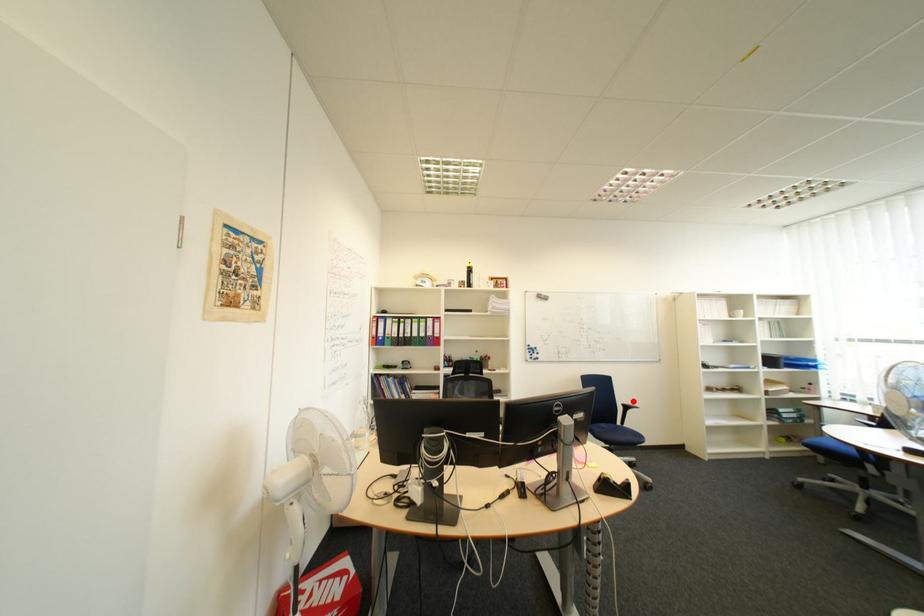
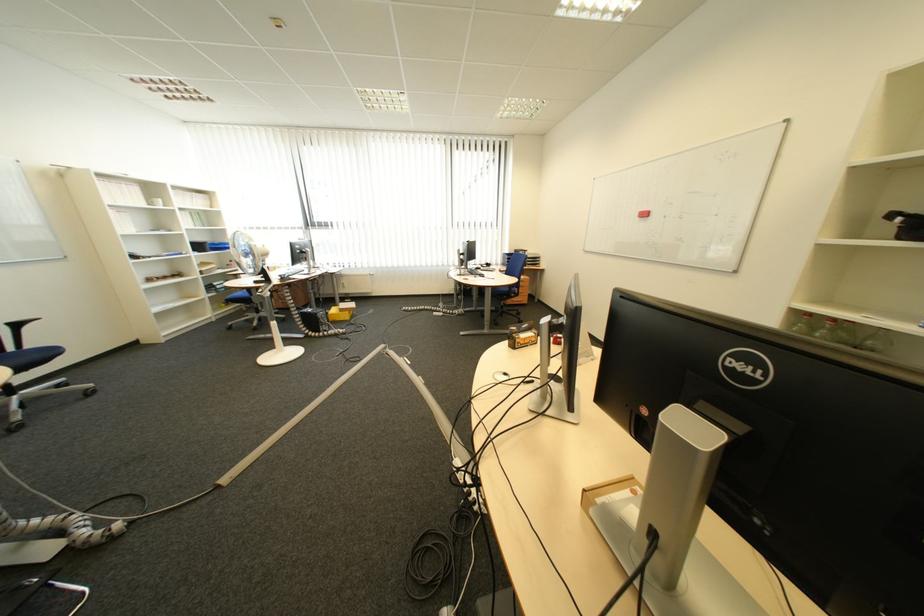
The point at the highlighted location is marked in the first image. Where is the corresponding point in the second image?

(13, 321)